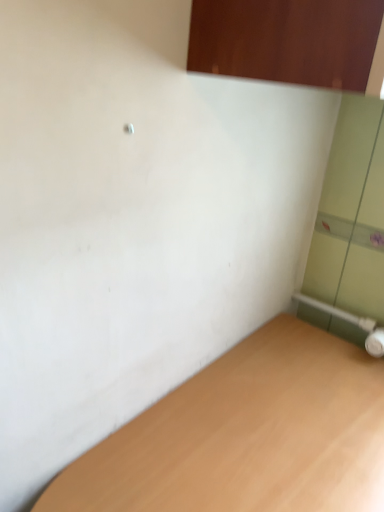
Measure the distance between light brown laminate counter top at lower right and camera.

light brown laminate counter top at lower right is 26.90 inches from camera.

What do you see at coordinates (247, 435) in the screenshot? I see `light brown laminate counter top at lower right` at bounding box center [247, 435].

What are the coordinates of `light brown laminate counter top at lower right` in the screenshot? It's located at (247, 435).

Identify the location of light brown laminate counter top at lower right. The width and height of the screenshot is (384, 512). (247, 435).